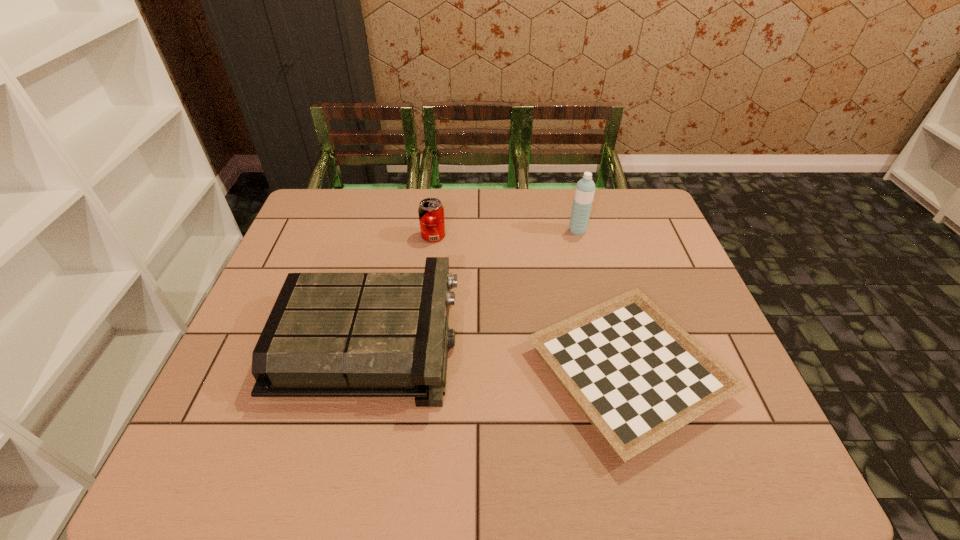
This screenshot has width=960, height=540. In order to click on object at the near edge in this screenshot , I will do `click(637, 376)`.

In order to click on object located at the left edge in this screenshot , I will do `click(329, 334)`.

Find the location of a particular element. This screenshot has height=540, width=960. object present at the right edge is located at coordinates (637, 376).

Locate an element on the screen. object present at the near right corner is located at coordinates (637, 376).

You are a GUI agent. You are given a task and a screenshot of the screen. Output one action in this format:
    pyautogui.click(x=<x>, y=<y>)
    Task: Click on the vacant position at the far edge of the desktop
    
    Given the screenshot: What is the action you would take?
    pyautogui.click(x=400, y=198)

In order to click on vacant space at the near edge of the desktop in this screenshot , I will do `click(530, 468)`.

Find the location of a particular element. vacant space at the left edge of the desktop is located at coordinates (242, 415).

In the image, there is a desktop. Where is `free space at the right edge`? free space at the right edge is located at coordinates (652, 290).

Image resolution: width=960 pixels, height=540 pixels. I want to click on vacant space at the near left corner of the desktop, so click(224, 455).

The image size is (960, 540). Find the location of `vacant space at the far right corner`. vacant space at the far right corner is located at coordinates (646, 231).